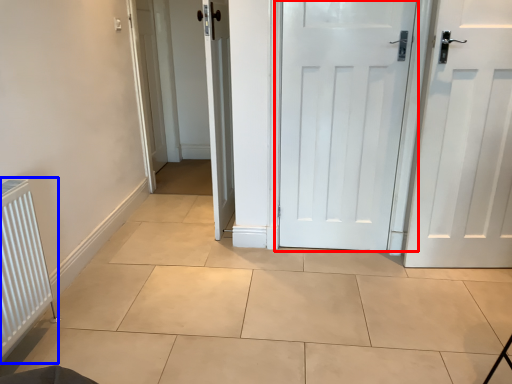
Question: Which object appears closest to the camera in this image, door (highlighted by a red box) or radiator (highlighted by a blue box)?

Choices:
 (A) door
 (B) radiator

Answer: (B)